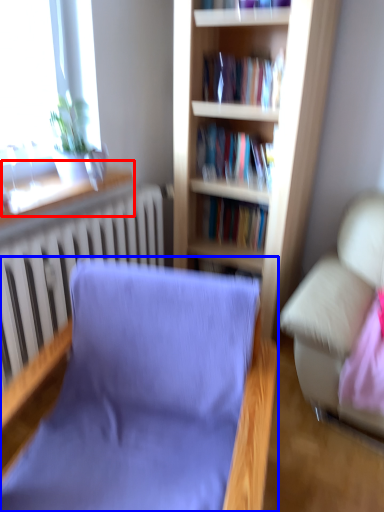
Question: Which object appears closest to the camera in this image, window sill (highlighted by a red box) or chair (highlighted by a blue box)?

Choices:
 (A) window sill
 (B) chair

Answer: (B)